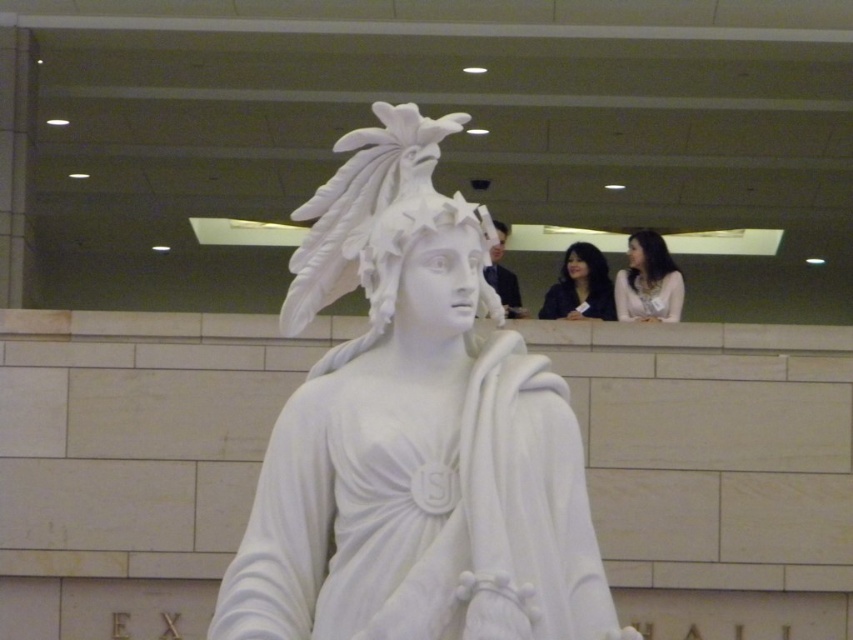
Describe the element at coordinates (648, 282) in the screenshot. I see `smooth white blouse at upper right` at that location.

Is smooth white blouse at upper right thinner than dark blue fabric at upper center?

Yes, smooth white blouse at upper right is thinner than dark blue fabric at upper center.

Is point (625, 268) positioned after point (573, 269)?

No, (625, 268) is closer to viewer.

Identify the location of smooth white blouse at upper right. tap(648, 282).

Who is taller, white marble statue at center or smooth white blouse at upper right?

With more height is white marble statue at center.

Does white marble statue at center appear under smooth white blouse at upper right?

Correct, white marble statue at center is located below smooth white blouse at upper right.

Where is `white marble statue at center`? The height and width of the screenshot is (640, 853). white marble statue at center is located at coordinates (415, 435).

From the picture: Can you confirm if white marble statue at center is taller than dark blue fabric at upper center?

Yes, white marble statue at center is taller than dark blue fabric at upper center.

Can you confirm if white marble statue at center is shorter than dark blue fabric at upper center?

No.

Who is more forward, (546, 428) or (581, 314)?

Point (546, 428) is more forward.

Locate an element on the screen. The image size is (853, 640). white marble statue at center is located at coordinates (415, 435).